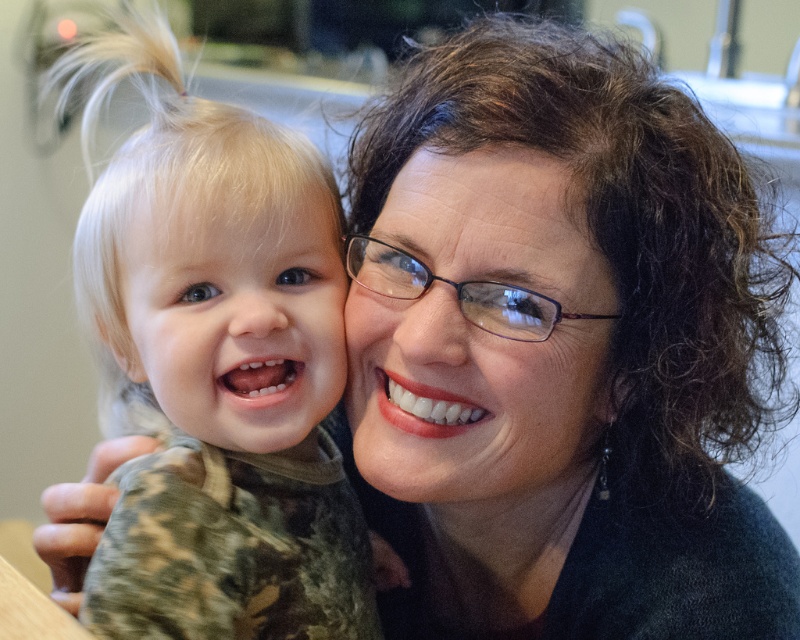
Question: Is smooth skin face at center closer to camera compared to blonde hair at left?

Choices:
 (A) no
 (B) yes

Answer: (B)

Question: Estimate the real-world distances between objects in this image. Which object is farther from the blonde hair at left?

Choices:
 (A) camouflage fabric toddler at left
 (B) smooth skin face at center

Answer: (B)

Question: Which point is farther to the camera?

Choices:
 (A) (293, 250)
 (B) (540, 168)

Answer: (A)

Question: Among these objects, which one is nearest to the camera?

Choices:
 (A) camouflage fabric toddler at left
 (B) smooth skin face at center
 (C) blonde hair at left

Answer: (A)

Question: Does smooth skin face at center appear over blonde hair at left?

Choices:
 (A) no
 (B) yes

Answer: (A)

Question: Is camouflage fabric toddler at left above blonde hair at left?

Choices:
 (A) yes
 (B) no

Answer: (B)